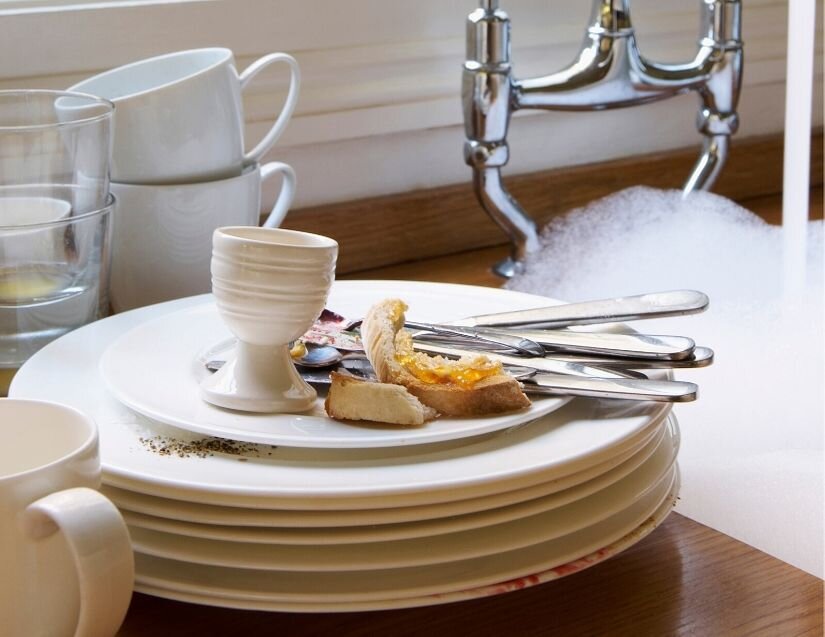
The height and width of the screenshot is (637, 825). I want to click on wood plank backsplash, so click(420, 232), click(413, 169), click(413, 117), click(407, 86), click(399, 51).